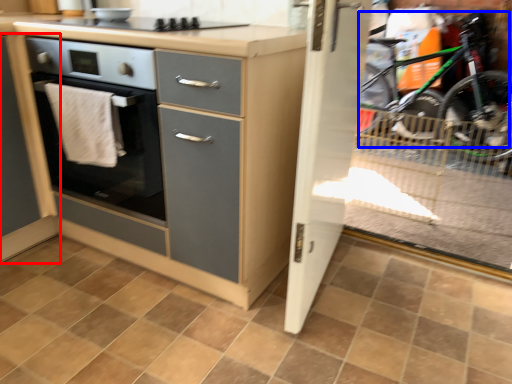
Question: Which point is further to the camera, cabinetry (highlighted by a red box) or mountain bike (highlighted by a blue box)?

Choices:
 (A) cabinetry
 (B) mountain bike

Answer: (B)